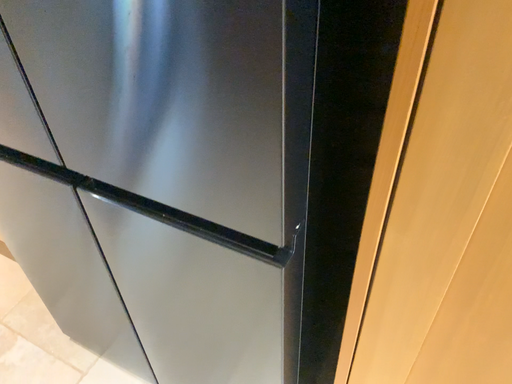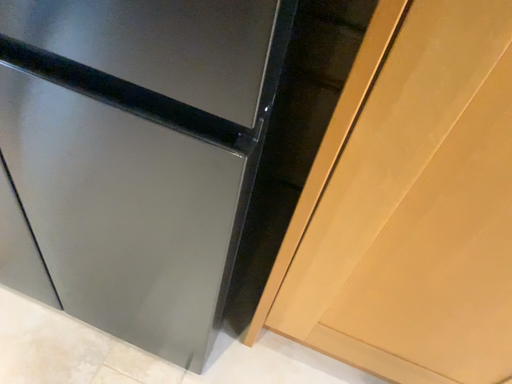
Question: How did the camera likely rotate when shooting the video?

Choices:
 (A) rotated upward
 (B) rotated downward

Answer: (B)